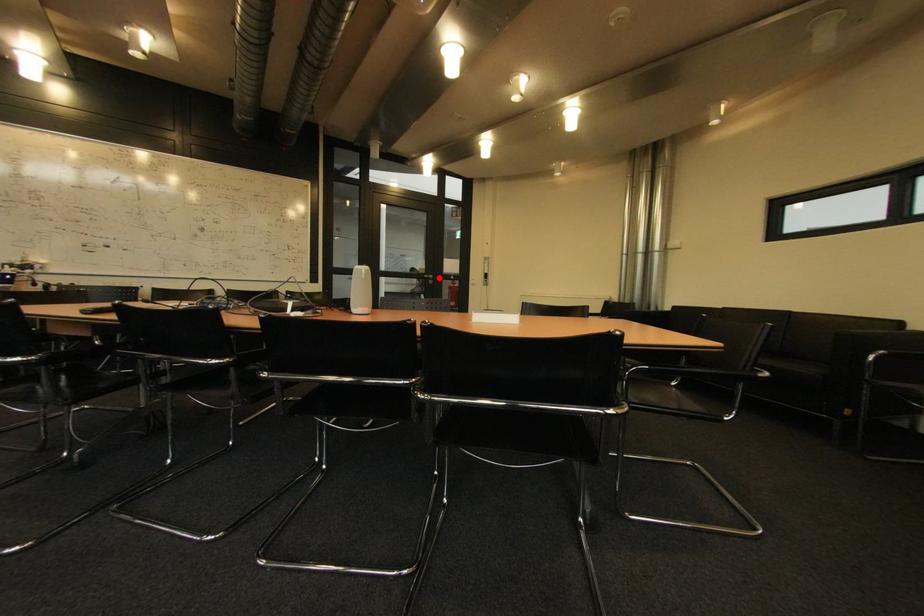
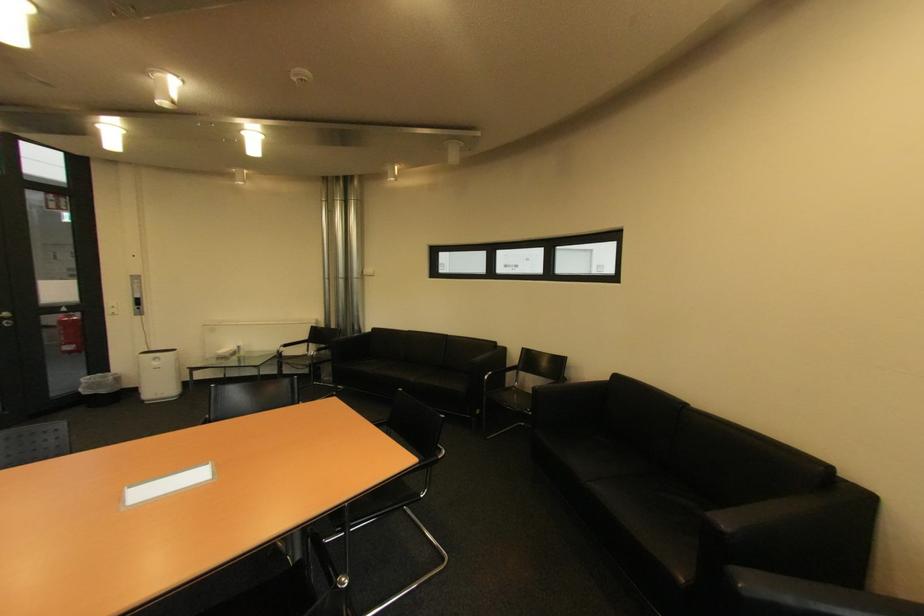
The point at the highlighted location is marked in the first image. Where is the corresponding point in the second image?

(14, 315)